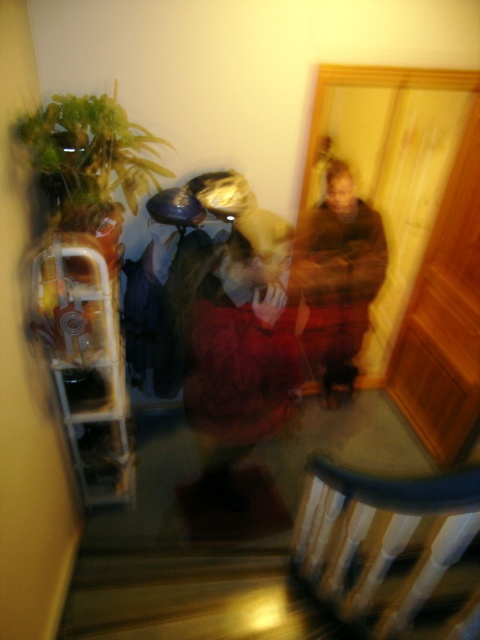
Question: Can you confirm if velvet red dress at center is positioned to the right of brown fuzzy sweater at center?

Choices:
 (A) yes
 (B) no

Answer: (B)

Question: Does white painted wood balustrade at bottom appear on the left side of brown fuzzy sweater at center?

Choices:
 (A) yes
 (B) no

Answer: (A)

Question: Can you confirm if white painted wood balustrade at bottom is positioned above velvet red dress at center?

Choices:
 (A) no
 (B) yes

Answer: (A)

Question: Based on their relative distances, which object is farther from the white painted wood balustrade at bottom?

Choices:
 (A) velvet red dress at center
 (B) brown fuzzy sweater at center

Answer: (B)

Question: Which is nearer to the velvet red dress at center?

Choices:
 (A) brown fuzzy sweater at center
 (B) white painted wood balustrade at bottom

Answer: (B)

Question: Which point appears farthest from the camera in this image?

Choices:
 (A) (359, 268)
 (B) (407, 564)

Answer: (A)